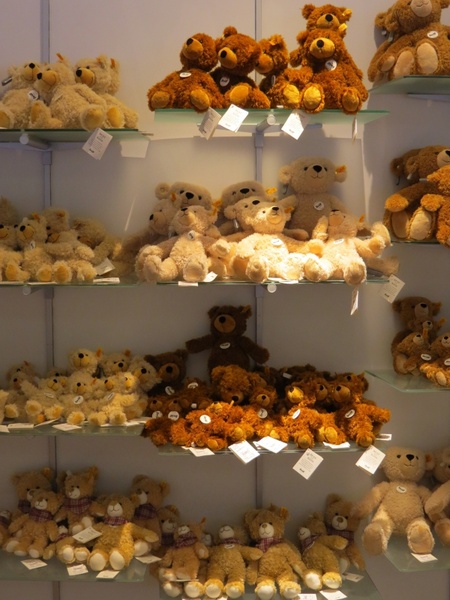
Where is `bar`? This screenshot has height=600, width=450. bar is located at coordinates (260, 490).